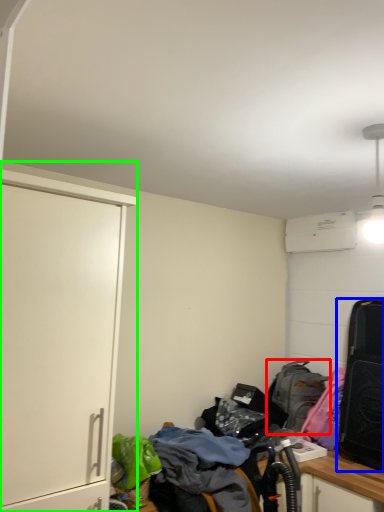
Question: Which object is positioned closest to backpack (highlighted by a red box)? Select from luggage and bags (highlighted by a blue box) and cabinetry (highlighted by a green box).

Choices:
 (A) luggage and bags
 (B) cabinetry

Answer: (A)